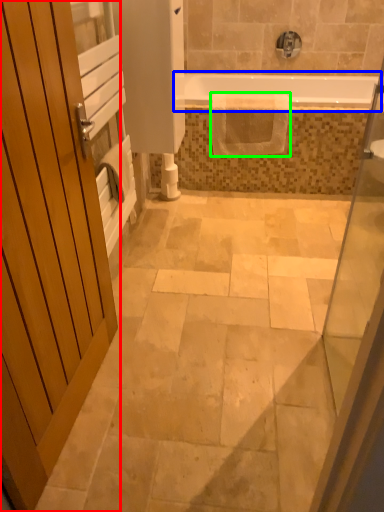
Question: Which object is the closest to the door (highlighted by a red box)? Choose among these: bathtub (highlighted by a blue box) or material (highlighted by a green box).

Choices:
 (A) bathtub
 (B) material

Answer: (B)